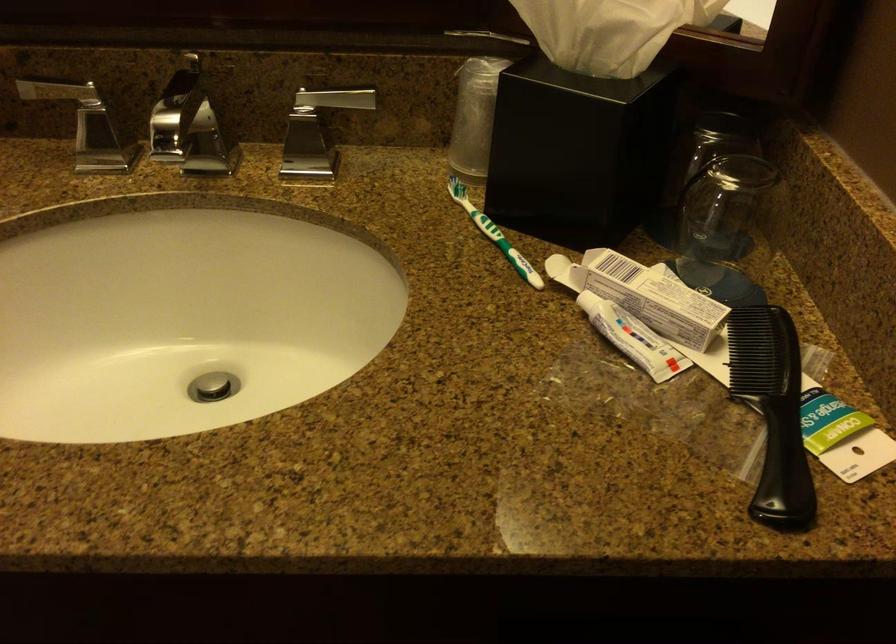
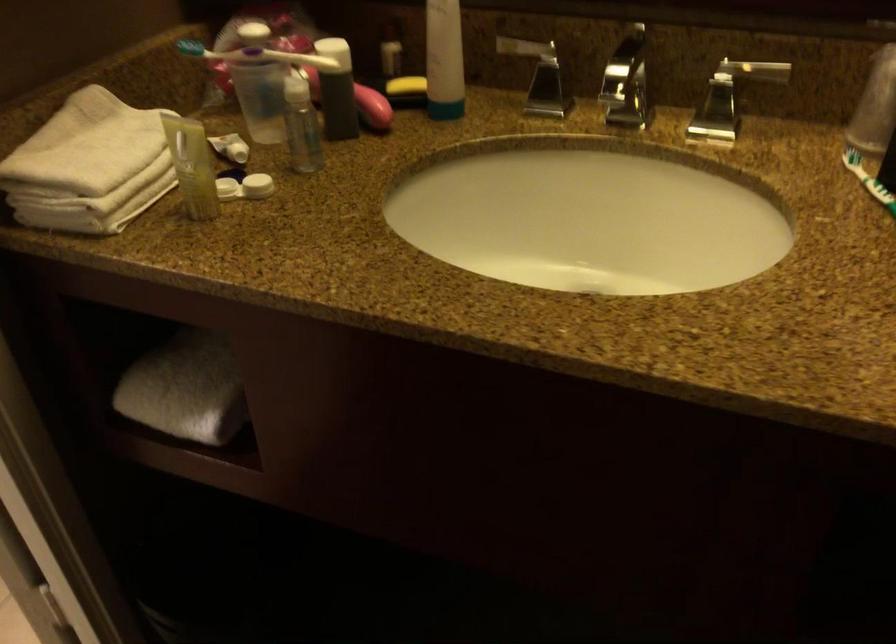
Question: How did the camera likely rotate?

Choices:
 (A) Left
 (B) Right
 (C) Up
 (D) Down

Answer: (A)